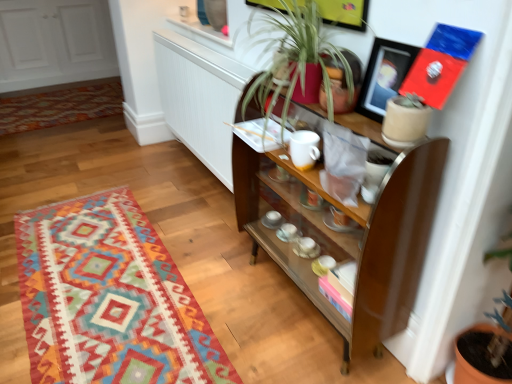
This screenshot has width=512, height=384. What are the coordinates of `vacant region below textured wool rug at lower left, which ranks as the 1th mat in bottom-to-top order (from a real-world perspective)` in the screenshot? It's located at (113, 282).